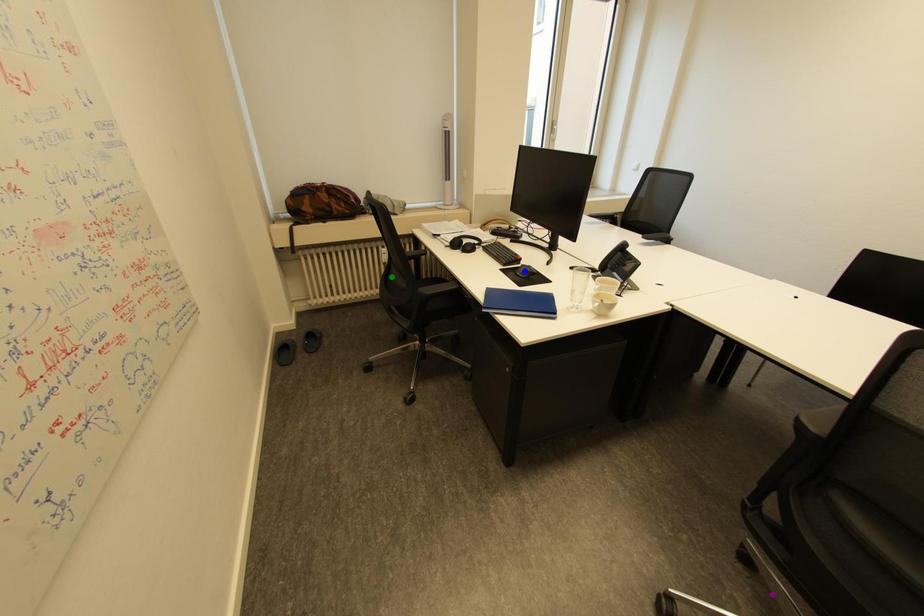
Order these from nearest to farthest:
1. blue point
2. purple point
3. green point

purple point, blue point, green point